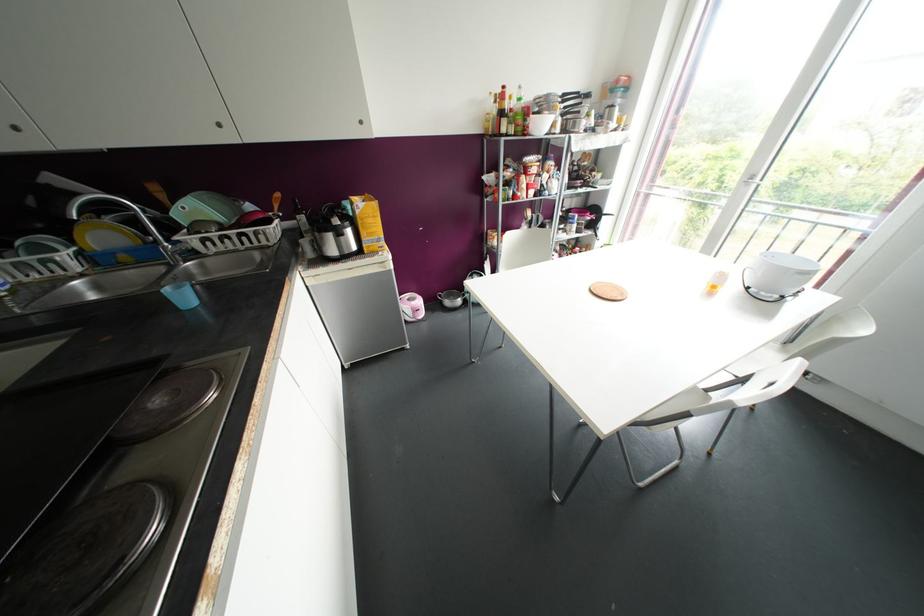
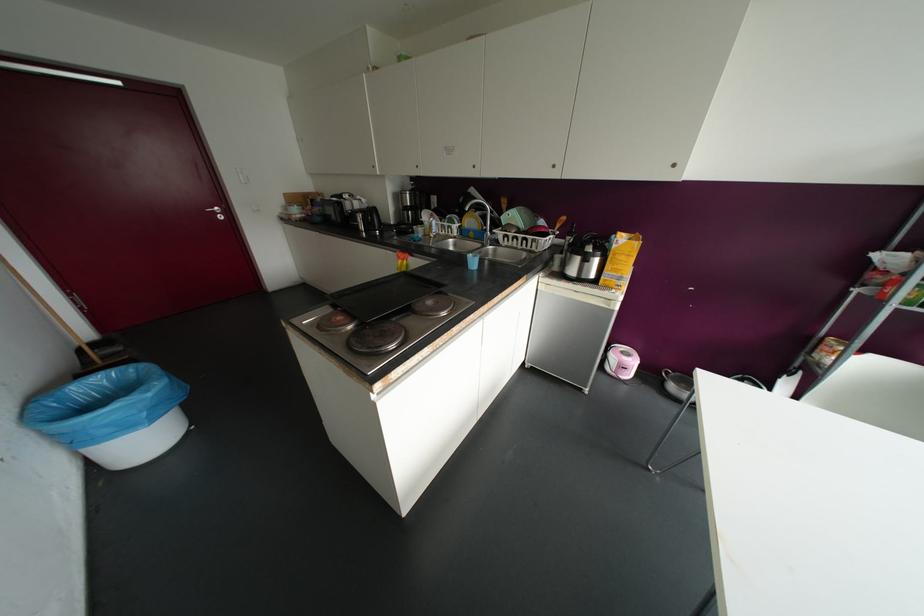
In the second image, find the point that corresponds to [103,236] in the first image.

(469, 221)